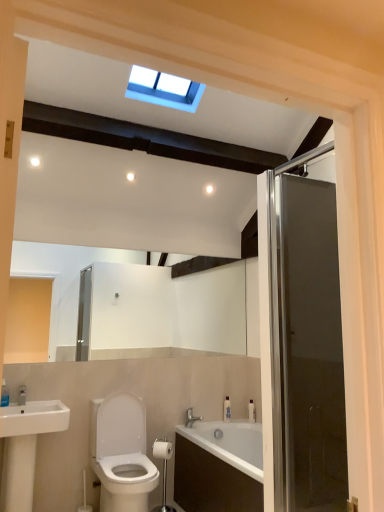
Question: From a real-world perspective, is white plastic bottle at right, the 2th toiletry viewed from the left, physically located above or below white glossy bottle at lower center, positioned as the first toiletry in left-to-right order?

Choices:
 (A) below
 (B) above

Answer: (A)

Question: Does point coord(251,415) appear closer or farther from the camera than point coord(223,413)?

Choices:
 (A) closer
 (B) farther

Answer: (A)

Question: Which object is the closest to the white plastic toilet paper holder at lower center, arranged as the first towel bar when ordered from the bottom?

Choices:
 (A) white plastic bottle at right, the 2th toiletry viewed from the left
 (B) silver metallic toilet paper holder at lower center, the second towel bar positioned from the bottom
 (C) white glossy toilet at lower left
 (D) transparent glass door at right
 (E) white glossy bottle at lower center, positioned as the first toiletry in left-to-right order

Answer: (B)

Question: Which object is the farthest from the white glossy sink at lower left?

Choices:
 (A) transparent glass door at right
 (B) white plastic toilet paper holder at lower center, the 2th towel bar when ordered from top to bottom
 (C) white glossy toilet at lower left
 (D) white glossy bottle at lower center, positioned as the first toiletry in left-to-right order
 (E) silver metallic toilet paper holder at lower center, marked as the first towel bar in a top-to-bottom arrangement

Answer: (A)